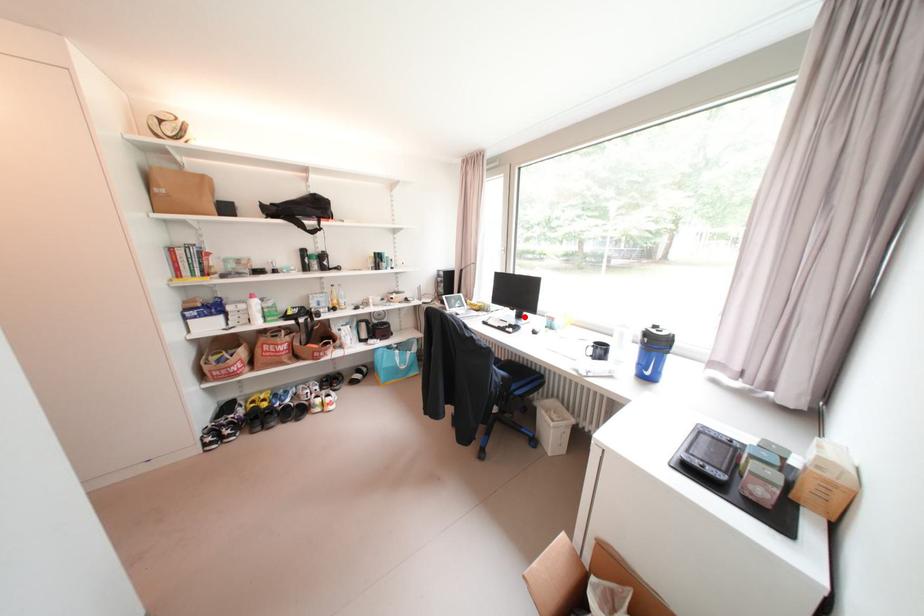
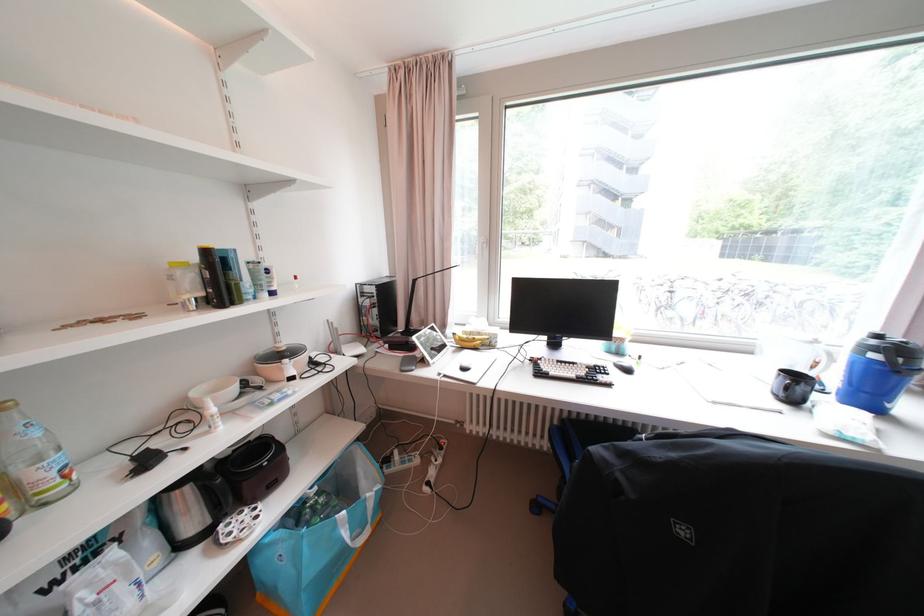
Question: I am providing you with two images of the same scene from different viewpoints. In image1, a red point is highlighted. Considering the same 3D point in image2, which of the following is correct?

Choices:
 (A) It is closer
 (B) It is farther

Answer: (B)